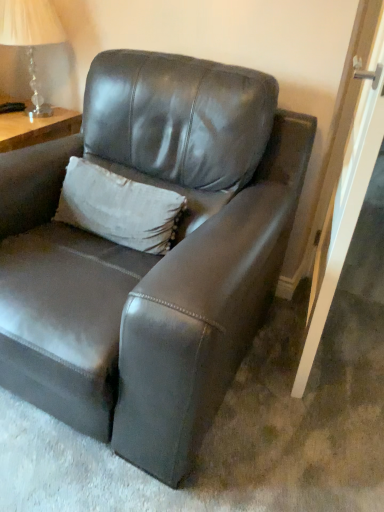
The width and height of the screenshot is (384, 512). Describe the element at coordinates (119, 207) in the screenshot. I see `white textured pillow at upper center` at that location.

The height and width of the screenshot is (512, 384). Identify the location of matte leather couch at center. (149, 255).

Identify the location of white textured pillow at upper center. The image size is (384, 512). (119, 207).

Between matte leather couch at center and clear glass lamp at upper left, which one has more height?

matte leather couch at center.

Looking at this image, how distant is matte leather couch at center from clear glass lamp at upper left?

A distance of 32.65 inches exists between matte leather couch at center and clear glass lamp at upper left.

From a real-world perspective, is matte leather couch at center below clear glass lamp at upper left?

Yes, from a real-world perspective, matte leather couch at center is below clear glass lamp at upper left.

From the image's perspective, is matte leather couch at center below clear glass lamp at upper left?

Indeed, from the image's perspective, matte leather couch at center is shown beneath clear glass lamp at upper left.

Is white textured pillow at upper center smaller than clear glass lamp at upper left?

Indeed, white textured pillow at upper center has a smaller size compared to clear glass lamp at upper left.

From the picture: Looking at their sizes, would you say white textured pillow at upper center is wider or thinner than clear glass lamp at upper left?

In the image, white textured pillow at upper center appears to be more narrow than clear glass lamp at upper left.

Measure the distance from white textured pillow at upper center to clear glass lamp at upper left.

The distance of white textured pillow at upper center from clear glass lamp at upper left is 27.09 inches.

Is white textured pillow at upper center turned away from clear glass lamp at upper left?

No, clear glass lamp at upper left is not at the back of white textured pillow at upper center.

Are clear glass lamp at upper left and matte leather couch at center far apart?

That's not correct — clear glass lamp at upper left is a little close to matte leather couch at center.

Is point (42, 26) closer or farther from the camera than point (87, 132)?

Point (42, 26) is farther from the camera than point (87, 132).

The height and width of the screenshot is (512, 384). Identify the location of table lamp that appears above the matte leather couch at center (from the image's perspective). (31, 38).

Who is shorter, clear glass lamp at upper left or matte leather couch at center?

clear glass lamp at upper left.

From a real-world perspective, is clear glass lamp at upper left positioned above or below white textured pillow at upper center?

From a real-world perspective, clear glass lamp at upper left is physically above white textured pillow at upper center.

How many degrees apart are the facing directions of clear glass lamp at upper left and white textured pillow at upper center?

They differ by 4.01 degrees in their facing directions.

Considering the relative sizes of clear glass lamp at upper left and white textured pillow at upper center in the image provided, is clear glass lamp at upper left shorter than white textured pillow at upper center?

Incorrect, the height of clear glass lamp at upper left does not fall short of that of white textured pillow at upper center.

Who is bigger, clear glass lamp at upper left or white textured pillow at upper center?

With larger size is clear glass lamp at upper left.

Based on the photo, who is shorter, matte leather couch at center or white textured pillow at upper center?

Standing shorter between the two is white textured pillow at upper center.

Can you confirm if matte leather couch at center is smaller than white textured pillow at upper center?

Actually, matte leather couch at center might be larger than white textured pillow at upper center.

From the image's perspective, would you say matte leather couch at center is shown under white textured pillow at upper center?

Yes, from the image's perspective, matte leather couch at center is below white textured pillow at upper center.

How many degrees apart are the facing directions of matte leather couch at center and white textured pillow at upper center?

There is a 1.66-degree angle between the facing directions of matte leather couch at center and white textured pillow at upper center.

Can you confirm if white textured pillow at upper center is positioned to the left of matte leather couch at center?

Indeed, white textured pillow at upper center is positioned on the left side of matte leather couch at center.

This screenshot has height=512, width=384. What are the coordinates of `studio couch on the right of white textured pillow at upper center` in the screenshot? It's located at (149, 255).

What's the angular difference between white textured pillow at upper center and matte leather couch at center's facing directions?

The angular difference between white textured pillow at upper center and matte leather couch at center is 1.66 degrees.

At what (x,y) coordinates should I click in order to perform the action: click on studio couch on the right of clear glass lamp at upper left. Please return your answer as a coordinate pair (x, y). The image size is (384, 512). Looking at the image, I should click on (149, 255).

Image resolution: width=384 pixels, height=512 pixels. What are the coordinates of `pillow located underneath the clear glass lamp at upper left (from a real-world perspective)` in the screenshot? It's located at (119, 207).

Based on their spatial positions, is matte leather couch at center or clear glass lamp at upper left further from white textured pillow at upper center?

clear glass lamp at upper left.

Looking at the image, which one is located closer to clear glass lamp at upper left, white textured pillow at upper center or matte leather couch at center?

white textured pillow at upper center.

Estimate the real-world distances between objects in this image. Which object is closer to white textured pillow at upper center, clear glass lamp at upper left or matte leather couch at center?

matte leather couch at center lies closer to white textured pillow at upper center than the other object.

Looking at this image, based on their spatial positions, is clear glass lamp at upper left or white textured pillow at upper center closer to matte leather couch at center?

white textured pillow at upper center is positioned closer to the anchor matte leather couch at center.

Looking at the image, which one is located closer to matte leather couch at center, white textured pillow at upper center or clear glass lamp at upper left?

white textured pillow at upper center.

When comparing their distances from clear glass lamp at upper left, does matte leather couch at center or white textured pillow at upper center seem further?

matte leather couch at center is further to clear glass lamp at upper left.

The width and height of the screenshot is (384, 512). What are the coordinates of `pillow located between matte leather couch at center and clear glass lamp at upper left in the depth direction` in the screenshot? It's located at (119, 207).